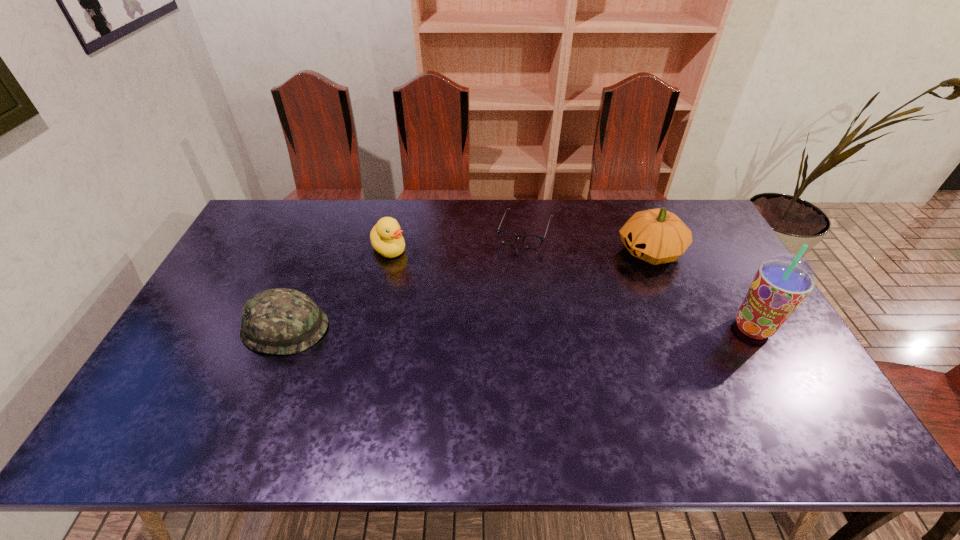
The width and height of the screenshot is (960, 540). Find the location of `duck located at the far edge`. duck located at the far edge is located at coordinates (386, 237).

Find the location of a particular element. The width and height of the screenshot is (960, 540). gourd that is at the far edge is located at coordinates (657, 236).

Locate an element on the screen. object that is at the left edge is located at coordinates (281, 321).

Image resolution: width=960 pixels, height=540 pixels. Identify the location of smoothie that is at the right edge. (782, 282).

This screenshot has height=540, width=960. I want to click on gourd that is at the right edge, so click(657, 236).

Where is `object at the far right corner`? This screenshot has height=540, width=960. object at the far right corner is located at coordinates (657, 236).

Where is `free space at the far edge of the desktop`? The height and width of the screenshot is (540, 960). free space at the far edge of the desktop is located at coordinates (406, 208).

The width and height of the screenshot is (960, 540). I want to click on free space at the near edge of the desktop, so click(x=507, y=396).

Where is `vacant region at the right edge of the desktop`? vacant region at the right edge of the desktop is located at coordinates (x=767, y=346).

Find the location of a particular element. This screenshot has height=540, width=960. free space at the far left corner is located at coordinates (260, 226).